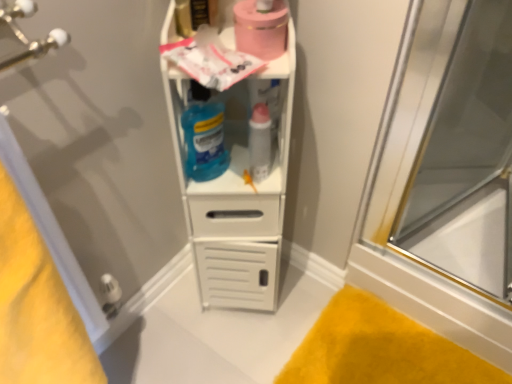
You are a GUI agent. You are given a task and a screenshot of the screen. Output one action in this format:
    pyautogui.click(x=<x>, y=<y>)
    Task: Click on the vacant space underneath yellow plush bath mat at lower right (from a real-world perspective)
    This screenshot has width=512, height=384.
    Given the screenshot: What is the action you would take?
    pyautogui.click(x=379, y=354)